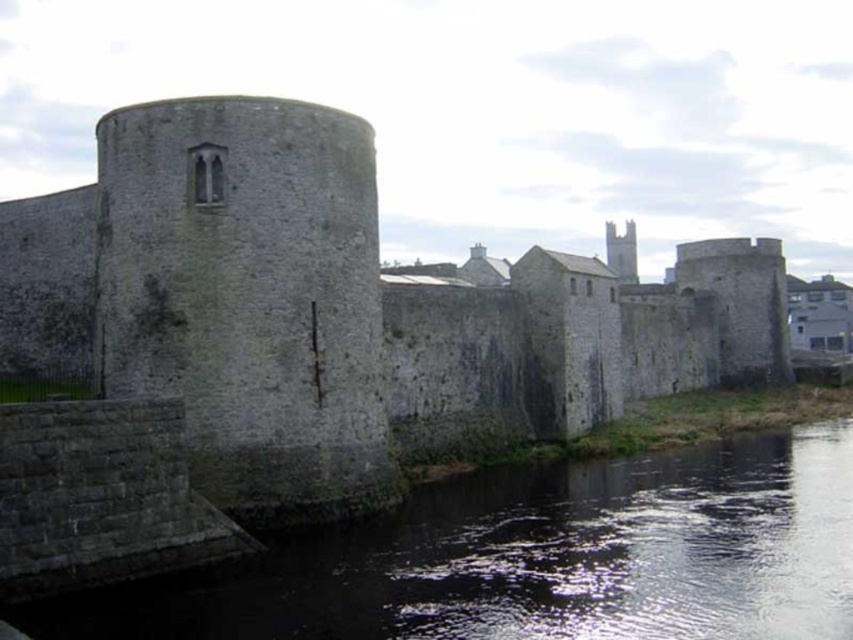
You are a tourist standing on the small stone bridge or walkway leading to the stone wall at center and dark gray stone river at lower center. Which object is taller from your perspective?

The stone wall at center is much taller than the dark gray stone river at lower center.

You are standing on the small stone bridge leading to the stone wall at center and dark gray stone river at lower center. Which object is located higher in elevation?

The stone wall at center is above dark gray stone river at lower center, so the stone wall at center is higher in elevation.